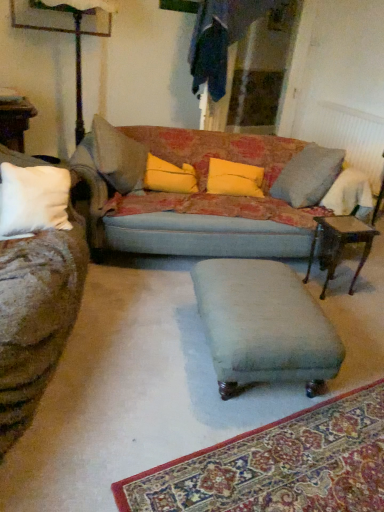
Find the location of `free location above velvet teal footrest at center (from a real-world perspective)`. free location above velvet teal footrest at center (from a real-world perspective) is located at coordinates (268, 292).